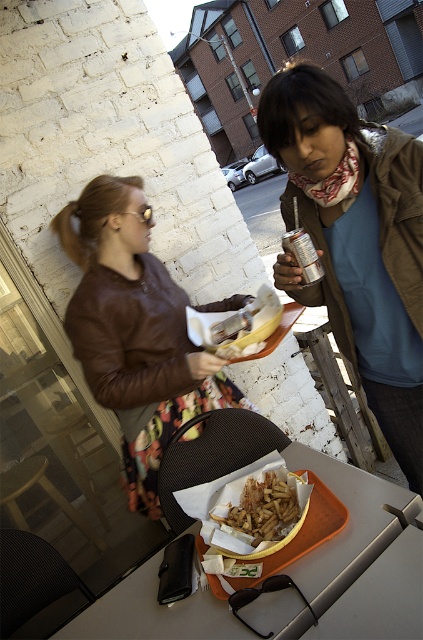
Question: Is matte brown leather jacket at center to the right of golden crispy fries at center from the viewer's perspective?

Choices:
 (A) yes
 (B) no

Answer: (A)

Question: Is matte brown leather jacket at center smaller than brown leather jacket at upper left?

Choices:
 (A) no
 (B) yes

Answer: (B)

Question: Among these objects, which one is nearest to the camera?

Choices:
 (A) brown leather jacket at upper left
 (B) orange tray at center
 (C) matte brown leather jacket at center
 (D) golden crispy fries at center

Answer: (B)

Question: Does matte brown leather jacket at center have a lesser width compared to orange tray at center?

Choices:
 (A) yes
 (B) no

Answer: (A)

Question: Which object is farther from the camera taking this photo?

Choices:
 (A) matte brown leather jacket at center
 (B) brown leather jacket at upper left
 (C) golden crispy fries at center
 (D) orange tray at center

Answer: (B)

Question: Estimate the real-world distances between objects in this image. Which object is farther from the golden crispy fries at center?

Choices:
 (A) orange tray at center
 (B) brown leather jacket at upper left
 (C) matte brown leather jacket at center

Answer: (B)